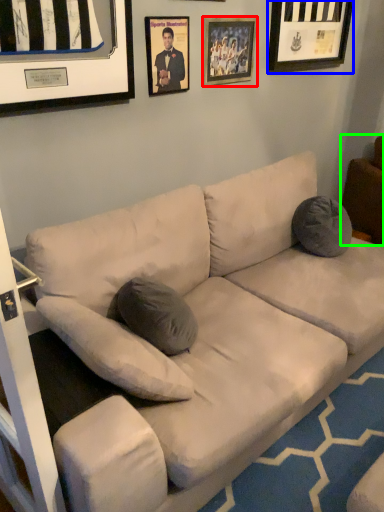
Question: Which object is positioned farthest from picture frame (highlighted by a red box)? Select from picture frame (highlighted by a blue box) and furniture (highlighted by a green box).

Choices:
 (A) picture frame
 (B) furniture

Answer: (B)